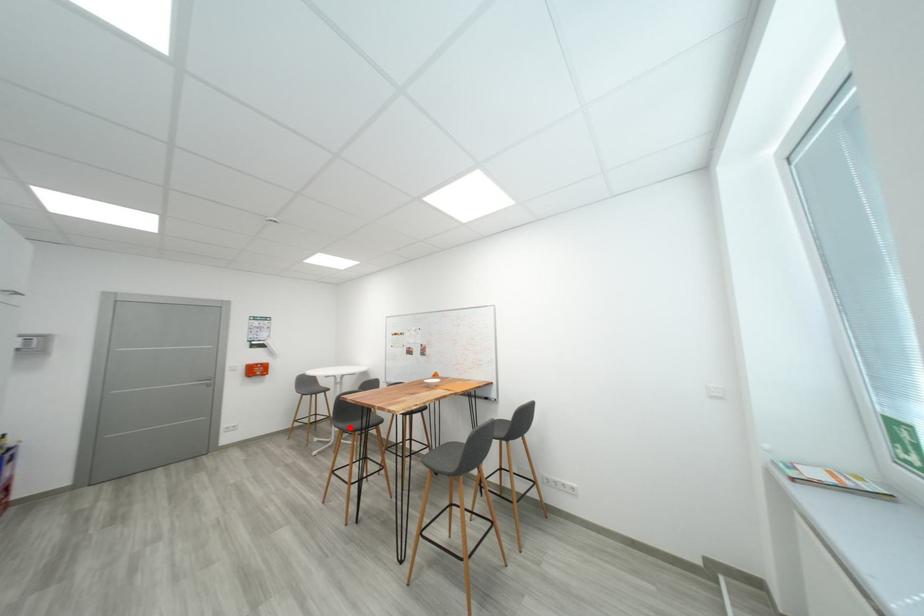
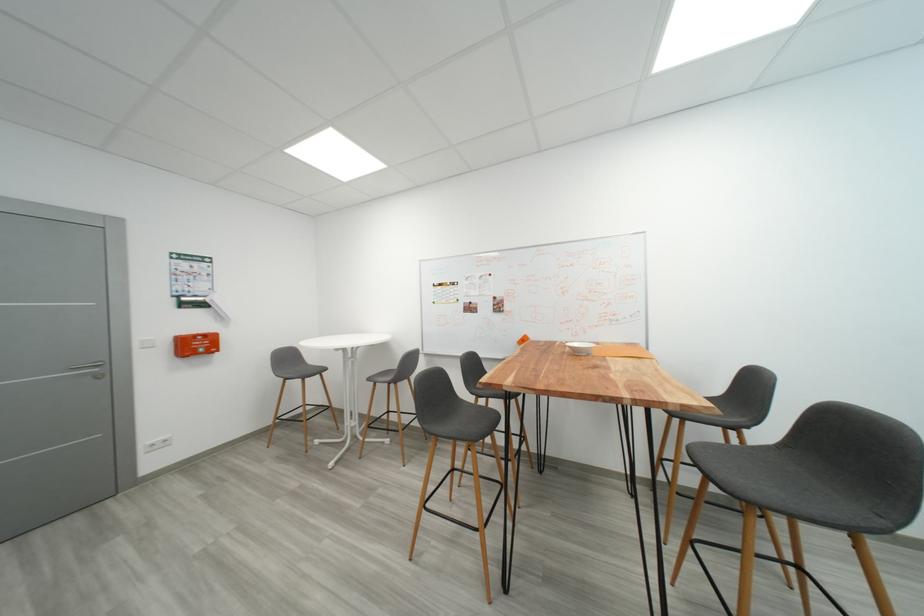
Question: I am providing you with two images of the same scene from different viewpoints. In image1, a red point is highlighted. Considering the same 3D point in image2, which of the following is correct?

Choices:
 (A) It is closer
 (B) It is farther

Answer: (A)